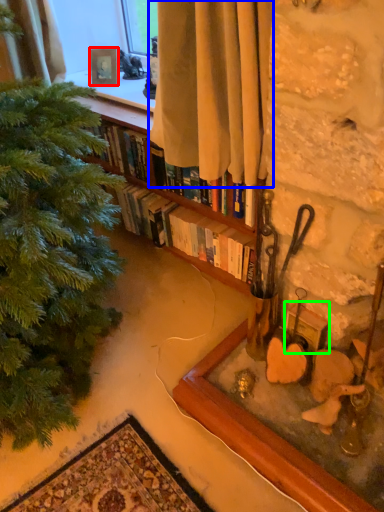
Question: Which is nearer to the picture frame (highlighted by a red box)? curtain (highlighted by a blue box) or picture frame (highlighted by a green box).

Choices:
 (A) curtain
 (B) picture frame

Answer: (A)